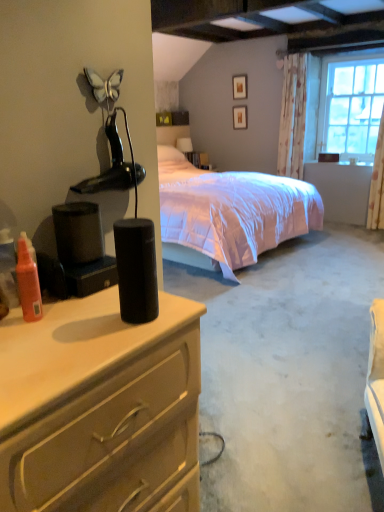
At what (x,y) coordinates should I click in order to perform the action: click on free space to the right of black matte speaker at center. Please return your answer as a coordinate pair (x, y). This screenshot has width=384, height=512. Looking at the image, I should click on (174, 314).